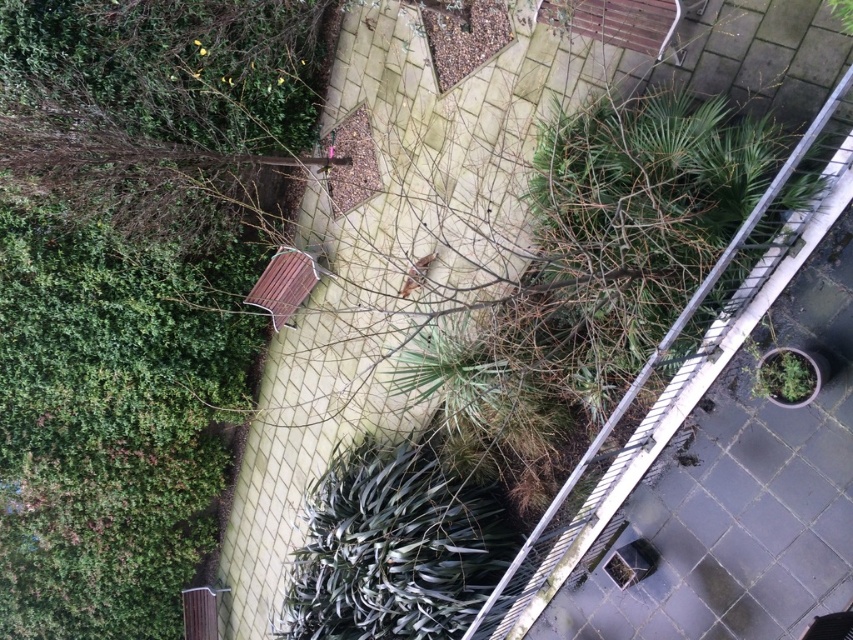
You are standing on the balcony looking at the wooden bench at center and the green matte pot at right. Which object is closer to you?

The wooden bench at center is closer to you because it is further to the viewer than the green matte pot at right.

You are standing at the edge of the garden and want to sit on the wooden bench at center. Based on the pathway and plants around, can you safely walk towards the bench without stepping on any plants?

The wooden bench at center is located at point coordinates, so yes, you can safely walk towards the bench along the paved pathway without stepping on any plants since the pathway is in the center and the plants are on the sides.